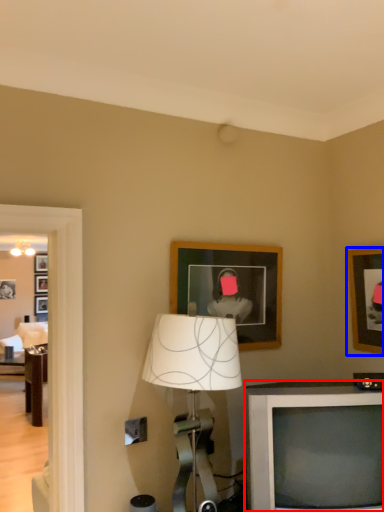
Question: Among these objects, which one is nearest to the camera, television (highlighted by a red box) or picture frame (highlighted by a blue box)?

Choices:
 (A) television
 (B) picture frame

Answer: (A)